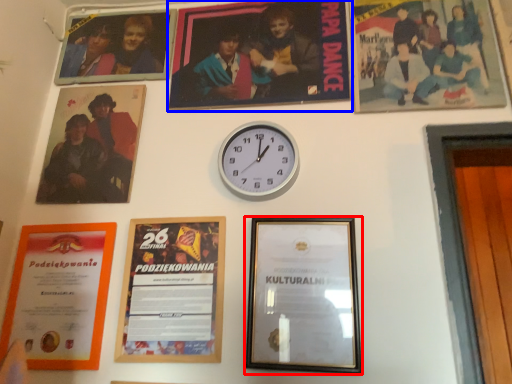
Question: Among these objects, which one is nearest to the camera, picture frame (highlighted by a red box) or picture frame (highlighted by a blue box)?

Choices:
 (A) picture frame
 (B) picture frame

Answer: (A)